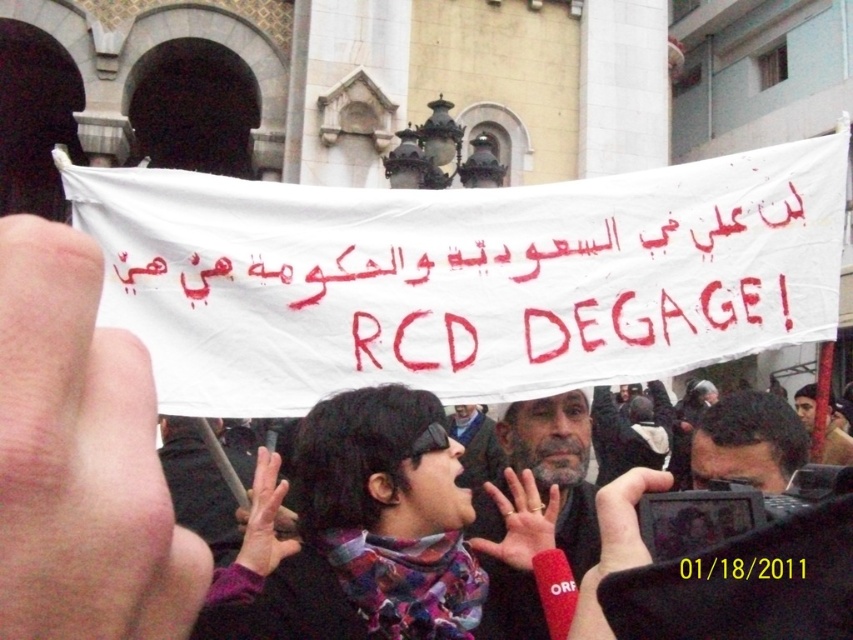
You are a photographer at the protest scene. You want to capture a closeup shot of the gray matte helmet at center and the gray hair man at center. Which object is wider so that it can fill the frame better?

The gray matte helmet at center is wider than the gray hair man at center, so it can fill the frame better.